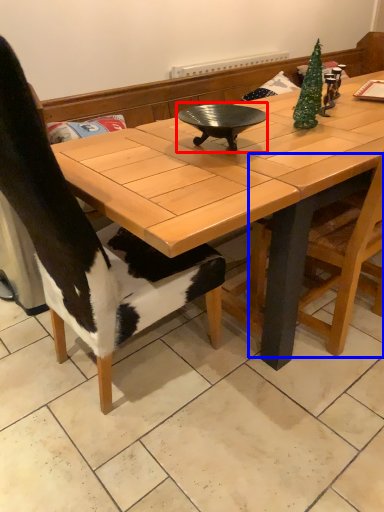
Question: Which point is closer to the camera, wok (highlighted by a red box) or chair (highlighted by a blue box)?

Choices:
 (A) wok
 (B) chair

Answer: (B)